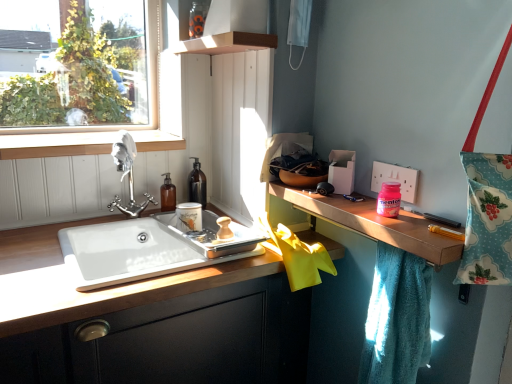
Question: From the image's perspective, would you say wooden cabinet at lower left is positioned over wooden at right?

Choices:
 (A) no
 (B) yes

Answer: (A)

Question: Is the surface of wooden cabinet at lower left in direct contact with wooden at right?

Choices:
 (A) no
 (B) yes

Answer: (A)

Question: Is wooden cabinet at lower left to the right of wooden at right from the viewer's perspective?

Choices:
 (A) no
 (B) yes

Answer: (A)

Question: From a real-world perspective, is wooden cabinet at lower left positioned over wooden at right based on gravity?

Choices:
 (A) yes
 (B) no

Answer: (B)

Question: Is the position of wooden cabinet at lower left more distant than that of wooden at right?

Choices:
 (A) no
 (B) yes

Answer: (A)

Question: Does wooden cabinet at lower left have a lesser width compared to wooden at right?

Choices:
 (A) yes
 (B) no

Answer: (B)

Question: Can you confirm if pink glossy mentos at upper right, placed as the first toiletry when sorted from right to left, is positioned to the right of floral fabric tote bag at right?

Choices:
 (A) no
 (B) yes

Answer: (A)

Question: Is pink glossy mentos at upper right, the first toiletry from the front, located outside floral fabric tote bag at right?

Choices:
 (A) yes
 (B) no

Answer: (A)

Question: Is pink glossy mentos at upper right, the second toiletry when ordered from back to front, beside floral fabric tote bag at right?

Choices:
 (A) yes
 (B) no

Answer: (B)

Question: Is pink glossy mentos at upper right, placed as the first toiletry when sorted from right to left, wider than floral fabric tote bag at right?

Choices:
 (A) yes
 (B) no

Answer: (B)

Question: Does pink glossy mentos at upper right, the first toiletry from the front, lie in front of floral fabric tote bag at right?

Choices:
 (A) no
 (B) yes

Answer: (A)

Question: Does pink glossy mentos at upper right, which appears as the second toiletry when viewed from the left, have a greater height compared to floral fabric tote bag at right?

Choices:
 (A) no
 (B) yes

Answer: (A)

Question: Is pink glossy mentos at upper right, the second toiletry when ordered from back to front, smaller than wooden at left?

Choices:
 (A) yes
 (B) no

Answer: (A)